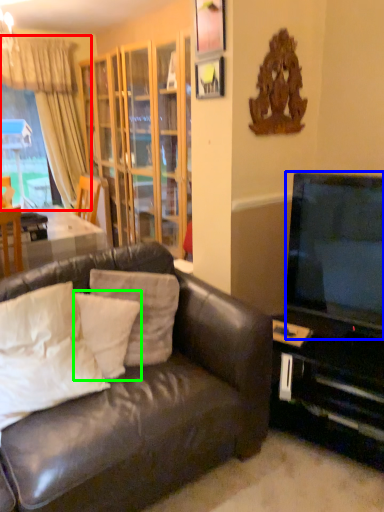
Question: Estimate the real-world distances between objects in this image. Which object is farther from curtain (highlighted by a red box), television (highlighted by a blue box) or pillow (highlighted by a green box)?

Choices:
 (A) television
 (B) pillow

Answer: (A)